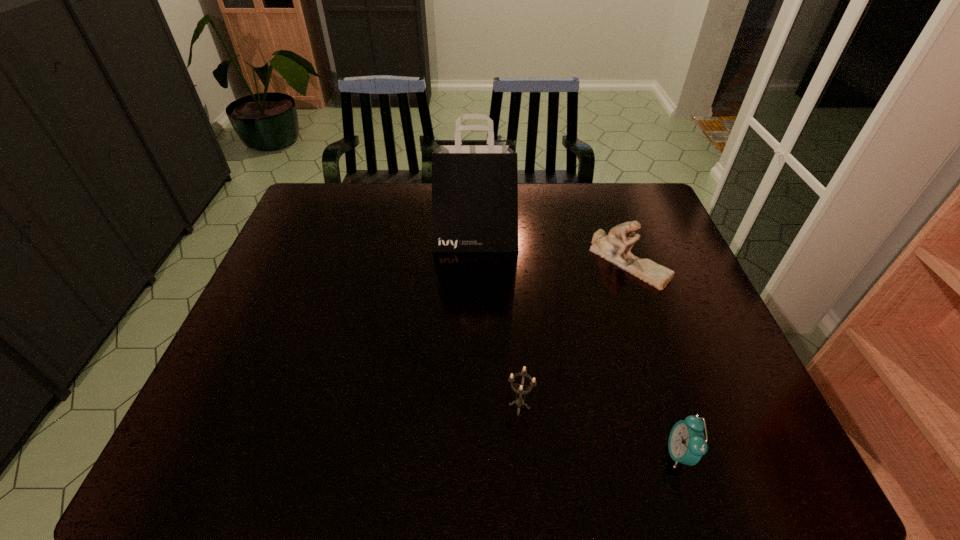
Where is `the tallest object`? The height and width of the screenshot is (540, 960). the tallest object is located at coordinates (474, 182).

You are a GUI agent. You are given a task and a screenshot of the screen. Output one action in this format:
    pyautogui.click(x=<x>, y=<y>)
    Task: Click on the third shortest object
    This screenshot has width=960, height=540.
    Given the screenshot: What is the action you would take?
    coord(615,247)

This screenshot has height=540, width=960. Find the location of `candle holder`. candle holder is located at coordinates (519, 402).

Where is `alarm clock`? This screenshot has width=960, height=540. alarm clock is located at coordinates (687, 444).

The width and height of the screenshot is (960, 540). In order to click on vacant area situated 0.280m on the front with handles of the tallest object in this screenshot , I will do `click(474, 324)`.

You are a GUI agent. You are given a task and a screenshot of the screen. Output one action in this format:
    pyautogui.click(x=<x>, y=<y>)
    Task: Click on the vacant space situated on the front-facing side of the figurine
    
    Given the screenshot: What is the action you would take?
    pyautogui.click(x=657, y=340)

At what (x,y) coordinates should I click in order to perform the action: click on free region located on the front of the candle holder. Please return your answer as a coordinate pair (x, y). This screenshot has width=960, height=540. Looking at the image, I should click on (523, 455).

This screenshot has width=960, height=540. Find the location of `free point located on the face of the nearest object`. free point located on the face of the nearest object is located at coordinates coord(626,454).

At what (x,y) coordinates should I click in order to perform the action: click on vacant space located on the face of the nearest object. Please return your answer as a coordinate pair (x, y). This screenshot has width=960, height=540. Looking at the image, I should click on (476, 454).

I want to click on free space located on the face of the nearest object, so click(616, 454).